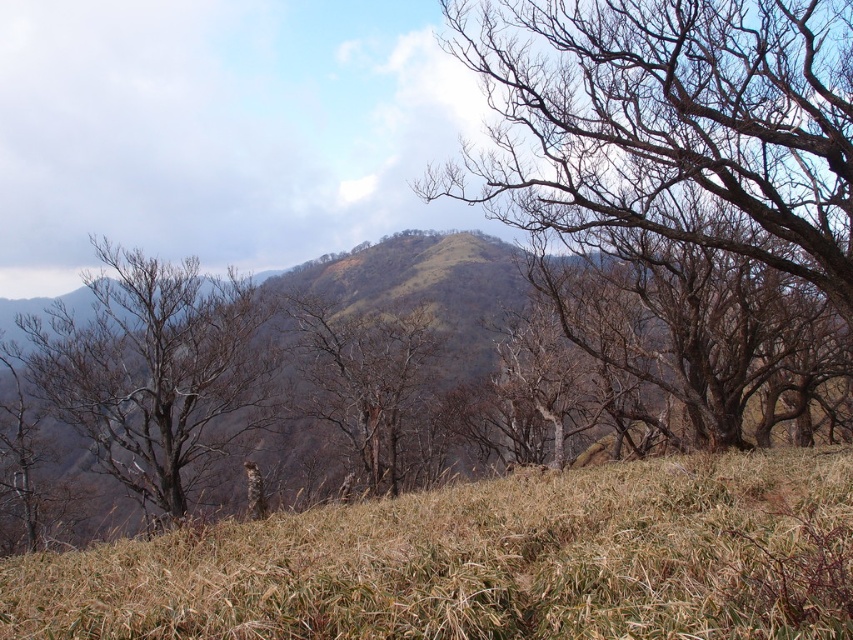
Question: Which object appears closest to the camera in this image?

Choices:
 (A) brown/dry bark tree at upper right
 (B) brown dry grass at lower center
 (C) bare branches at left

Answer: (B)

Question: Which of the following is the closest to the observer?

Choices:
 (A) brown matte tree at center
 (B) brown dry grass at lower center
 (C) brown/dry bark tree at upper right
 (D) bare branches at left

Answer: (B)

Question: Does brown/dry bark tree at upper right have a lesser width compared to brown matte tree at center?

Choices:
 (A) no
 (B) yes

Answer: (A)

Question: From the image, what is the correct spatial relationship of brown/dry bark tree at upper right in relation to bare branches at left?

Choices:
 (A) left
 (B) right

Answer: (B)

Question: Which point appears closest to the camera in this image?

Choices:
 (A) (370, 480)
 (B) (242, 406)
 (C) (467, 532)

Answer: (C)

Question: Observing the image, what is the correct spatial positioning of brown/dry bark tree at upper right in reference to brown matte tree at center?

Choices:
 (A) right
 (B) left

Answer: (A)